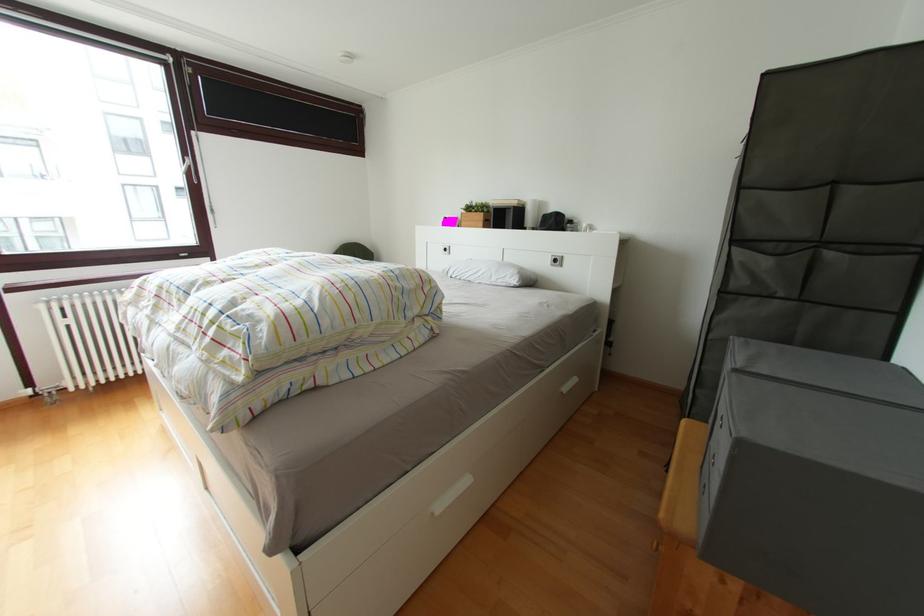
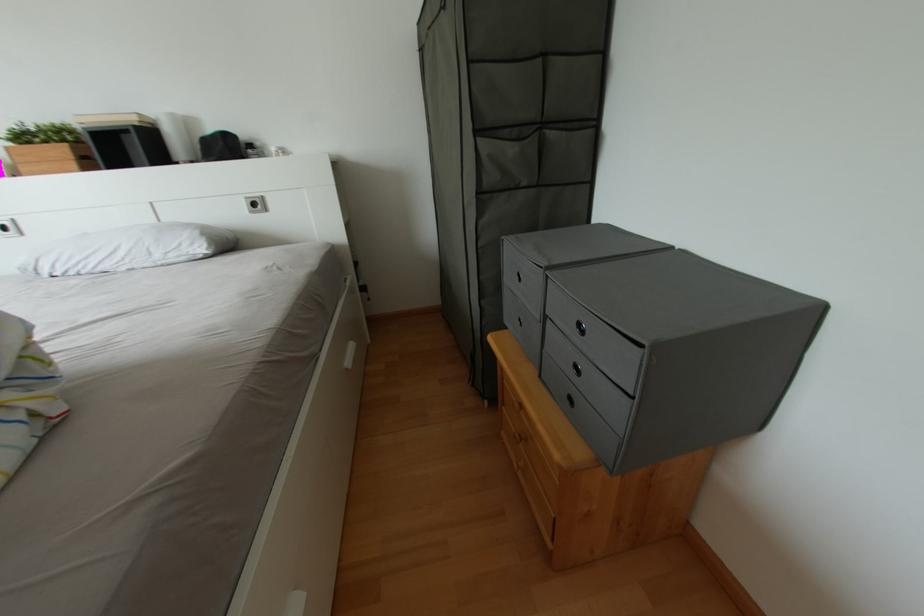
First-person continuous shooting, in which direction is the camera rotating?

The rotation direction of the camera is right-down.